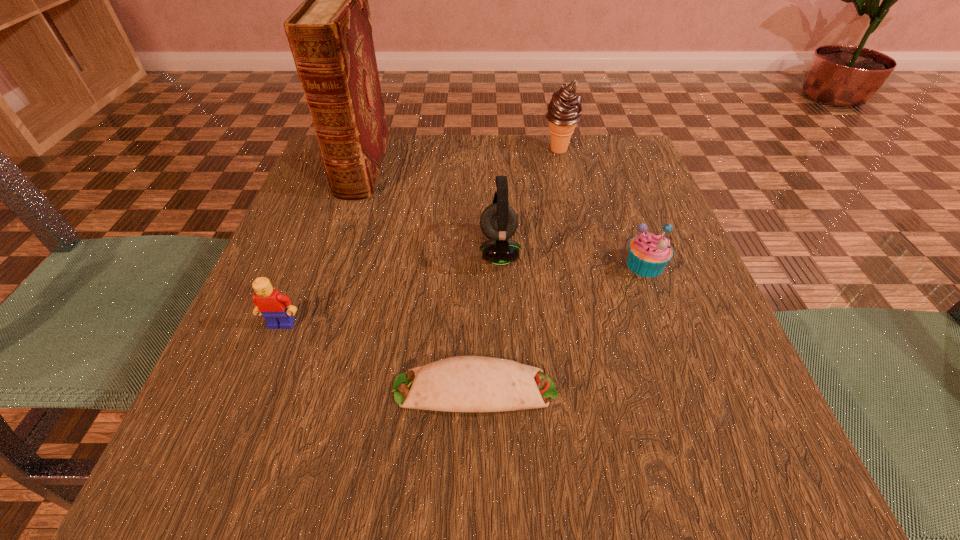
At what (x,y) coordinates should I click in order to perform the action: click on free space located 0.120m on the front of the icecream. Please return your answer as a coordinate pair (x, y). Looking at the image, I should click on (568, 190).

This screenshot has width=960, height=540. In order to click on vacant region located 0.310m on the ear cups of the fourth shortest object in this screenshot , I will do `click(309, 250)`.

Identify the location of vacant space located on the ear cups of the fourth shortest object. This screenshot has width=960, height=540. (420, 250).

Identify the location of free space located 0.050m on the ear cups of the fourth shortest object. The width and height of the screenshot is (960, 540). (452, 250).

Image resolution: width=960 pixels, height=540 pixels. I want to click on free space located 0.090m on the face of the fifth farthest object, so click(x=259, y=382).

Where is `blank space located 0.160m on the left of the rightmost object`? The width and height of the screenshot is (960, 540). blank space located 0.160m on the left of the rightmost object is located at coordinates (533, 265).

You are a GUI agent. You are given a task and a screenshot of the screen. Output one action in this format:
    pyautogui.click(x=<x>, y=<y>)
    Task: Click on the vacant space located at the bitten end of the shortest object
    
    Given the screenshot: What is the action you would take?
    pyautogui.click(x=665, y=388)

Where is `hardback book that is positioned at the far edge`? hardback book that is positioned at the far edge is located at coordinates (330, 33).

I want to click on icecream that is positioned at the far edge, so click(564, 110).

At what (x,y) coordinates should I click in order to perform the action: click on hardback book at the left edge. Please return your answer as a coordinate pair (x, y). The height and width of the screenshot is (540, 960). Looking at the image, I should click on (330, 33).